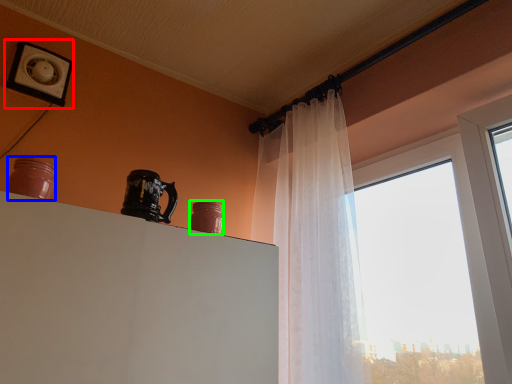
Question: Which object is positioned closest to picture frame (highlighted by a red box)? Select from pottery (highlighted by a blue box) and pottery (highlighted by a green box).

Choices:
 (A) pottery
 (B) pottery

Answer: (A)